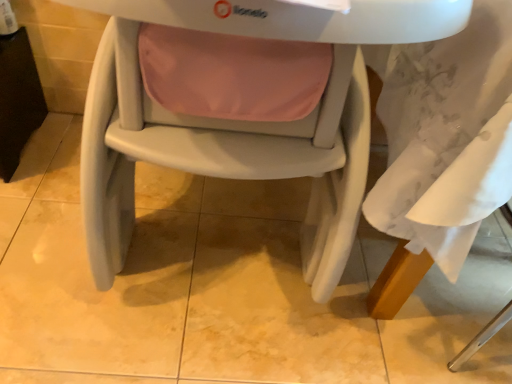
Question: Considering the relative positions of matte plastic highchair at center and black plastic table at left in the image provided, is matte plastic highchair at center to the left or to the right of black plastic table at left?

Choices:
 (A) left
 (B) right

Answer: (B)

Question: From a real-world perspective, is matte plastic highchair at center positioned above or below black plastic table at left?

Choices:
 (A) below
 (B) above

Answer: (B)

Question: From the image's perspective, relative to black plastic table at left, is matte plastic highchair at center above or below?

Choices:
 (A) below
 (B) above

Answer: (A)

Question: Is black plastic table at left in front of or behind matte plastic highchair at center in the image?

Choices:
 (A) front
 (B) behind

Answer: (B)

Question: Is black plastic table at left bigger or smaller than matte plastic highchair at center?

Choices:
 (A) small
 (B) big

Answer: (A)

Question: From the image's perspective, is black plastic table at left positioned above or below matte plastic highchair at center?

Choices:
 (A) above
 (B) below

Answer: (A)

Question: In terms of width, does black plastic table at left look wider or thinner when compared to matte plastic highchair at center?

Choices:
 (A) thin
 (B) wide

Answer: (A)